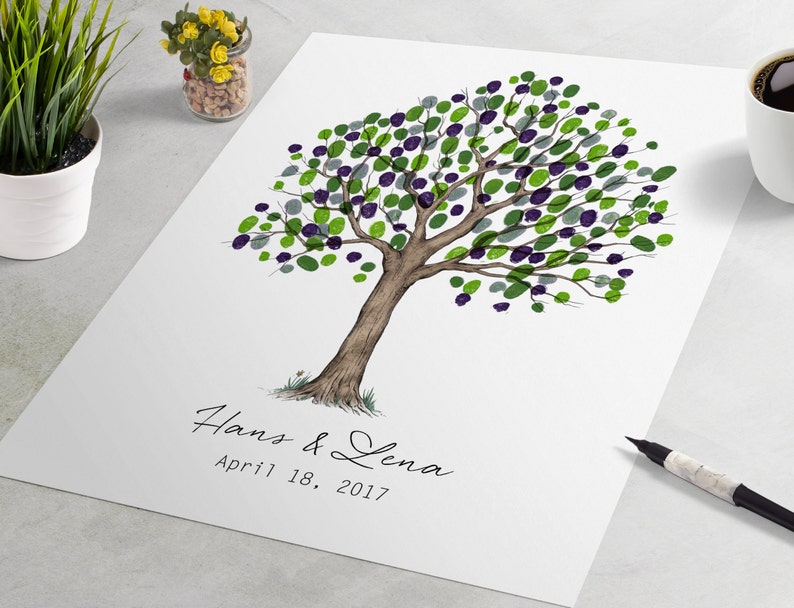
What are the coordinates of `cup` in the screenshot? It's located at (765, 149).